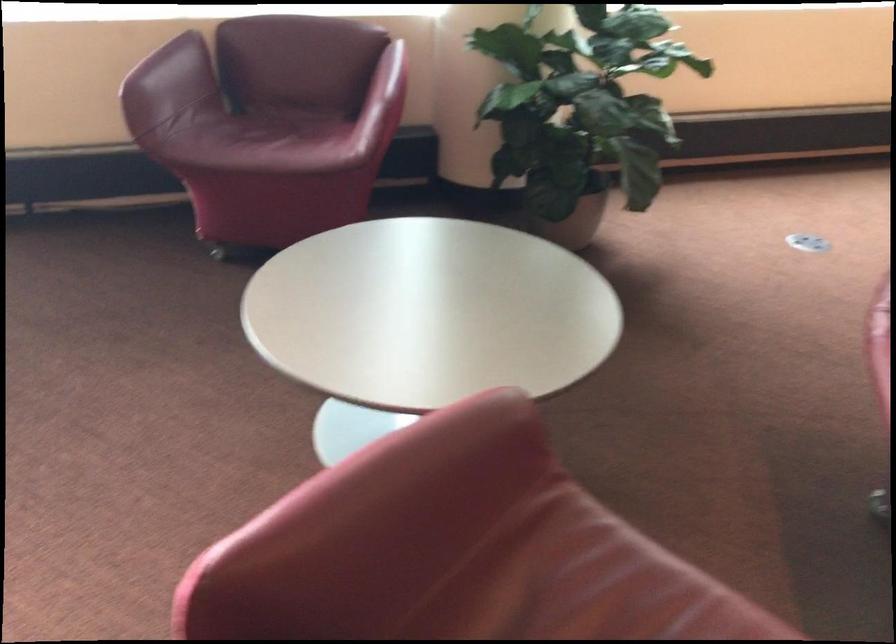
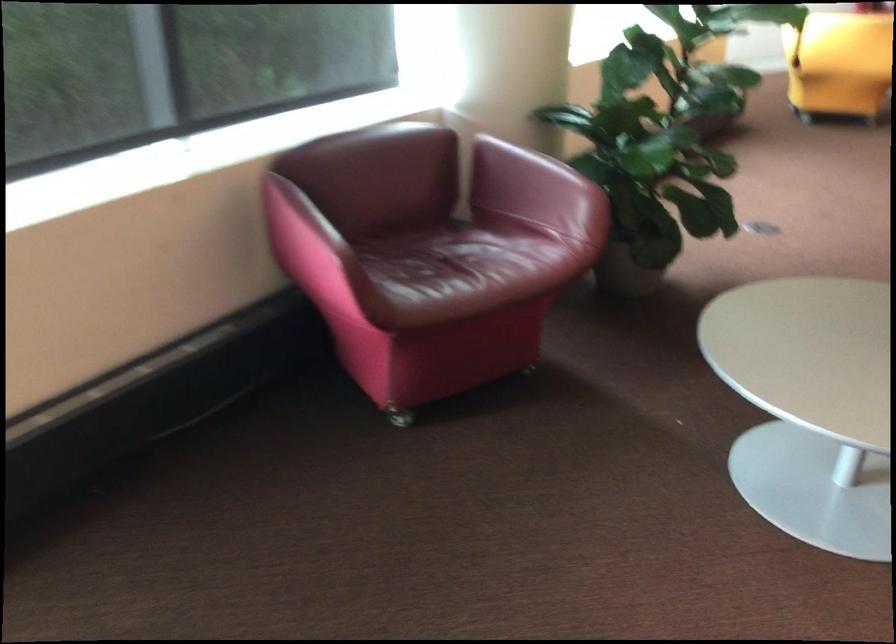
Where in the second image is the point corresponding to point 281,138 from the first image?

(466, 266)